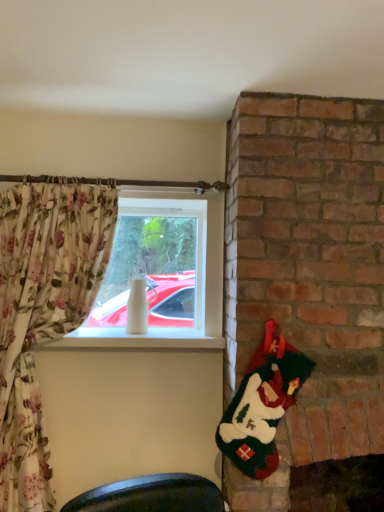
Question: Is fuzzy green santa at right taller than white glossy vase at center?

Choices:
 (A) no
 (B) yes

Answer: (A)

Question: Can you see fuzzy green santa at right touching white glossy vase at center?

Choices:
 (A) no
 (B) yes

Answer: (A)

Question: Is fuzzy green santa at right oriented towards white glossy vase at center?

Choices:
 (A) yes
 (B) no

Answer: (B)

Question: Does fuzzy green santa at right appear on the left side of white glossy vase at center?

Choices:
 (A) yes
 (B) no

Answer: (B)

Question: From the image's perspective, is fuzzy green santa at right under white glossy vase at center?

Choices:
 (A) yes
 (B) no

Answer: (A)

Question: Does fuzzy green santa at right have a lesser height compared to white glossy vase at center?

Choices:
 (A) no
 (B) yes

Answer: (B)

Question: Is fuzzy green santa at right inside white glossy vase at center?

Choices:
 (A) yes
 (B) no

Answer: (B)

Question: From the image's perspective, is white glossy vase at center above fuzzy green santa at right?

Choices:
 (A) yes
 (B) no

Answer: (A)

Question: Is white glossy vase at center positioned with its back to fuzzy green santa at right?

Choices:
 (A) no
 (B) yes

Answer: (A)

Question: Considering the relative sizes of white glossy vase at center and fuzzy green santa at right in the image provided, is white glossy vase at center shorter than fuzzy green santa at right?

Choices:
 (A) yes
 (B) no

Answer: (B)

Question: Is white glossy vase at center to the right of fuzzy green santa at right from the viewer's perspective?

Choices:
 (A) no
 (B) yes

Answer: (A)

Question: From the image's perspective, is white glossy vase at center under fuzzy green santa at right?

Choices:
 (A) no
 (B) yes

Answer: (A)

Question: From a real-world perspective, is fuzzy green santa at right physically located above or below white glossy vase at center?

Choices:
 (A) below
 (B) above

Answer: (A)